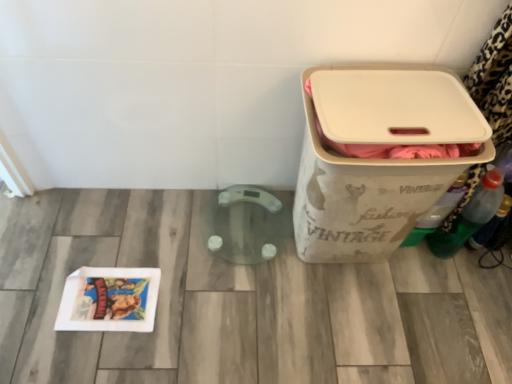
Measure the distance between point (432, 207) and camera.

The depth of point (432, 207) is 1.22 meters.

What is the approximate width of green plastic bottle at right, arranged as the third bottle when viewed from the right?

3.97 inches.

What is the approximate width of green plastic bottle at right, arranged as the second bottle when viewed from the right?

It is 3.89 inches.

The image size is (512, 384). I want to click on beige fabric storage bin at right, so click(378, 159).

This screenshot has width=512, height=384. Find the location of `translucent plastic bottle at right, marked as the 3th bottle in a left-to-right arrangement`. translucent plastic bottle at right, marked as the 3th bottle in a left-to-right arrangement is located at coordinates (490, 225).

You are a GUI agent. You are given a task and a screenshot of the screen. Output one action in this format:
    pyautogui.click(x=<x>, y=<y>)
    Task: Click on the green plastic bottle at right, which is the first bottle from left to right
    This screenshot has width=512, height=384.
    Given the screenshot: What is the action you would take?
    pyautogui.click(x=444, y=204)

Based on the photo, is green plastic bottle at right, arranged as the second bottle when viewed from the right, oriented away from beige fabric storage bin at right?

Yes, green plastic bottle at right, arranged as the second bottle when viewed from the right, is facing away from beige fabric storage bin at right.

Locate an element on the screen. This screenshot has width=512, height=384. the 2nd bottle behind the beige fabric storage bin at right, starting your count from the anchor is located at coordinates (470, 216).

Is beige fabric storage bin at right a part of green plastic bottle at right, the 2th bottle viewed from the left?

No, green plastic bottle at right, the 2th bottle viewed from the left, does not contain beige fabric storage bin at right.

Image resolution: width=512 pixels, height=384 pixels. I want to click on the 1st bottle below when counting from the green plastic bottle at right, arranged as the third bottle when viewed from the right (from the image's perspective), so 470,216.

Is green plastic bottle at right, arranged as the second bottle when viewed from the right, positioned with its back to green plastic bottle at right, which is the first bottle from left to right?

Yes, green plastic bottle at right, which is the first bottle from left to right, is at the back of green plastic bottle at right, arranged as the second bottle when viewed from the right.

Looking at this image, considering the positions of objects green plastic bottle at right, the 2th bottle viewed from the left, and green plastic bottle at right, arranged as the third bottle when viewed from the right, in the image provided, who is in front, green plastic bottle at right, the 2th bottle viewed from the left, or green plastic bottle at right, arranged as the third bottle when viewed from the right,?

green plastic bottle at right, arranged as the third bottle when viewed from the right, is closer to the camera.

Does green plastic bottle at right, which is the first bottle from left to right, turn towards beige fabric storage bin at right?

No, green plastic bottle at right, which is the first bottle from left to right, does not turn towards beige fabric storage bin at right.

Would you say green plastic bottle at right, which is the first bottle from left to right, is outside beige fabric storage bin at right?

Absolutely, green plastic bottle at right, which is the first bottle from left to right, is external to beige fabric storage bin at right.

From the picture: Which is more to the right, green plastic bottle at right, arranged as the third bottle when viewed from the right, or beige fabric storage bin at right?

Positioned to the right is green plastic bottle at right, arranged as the third bottle when viewed from the right.

Between beige fabric storage bin at right and translucent plastic bottle at right, marked as the 3th bottle in a left-to-right arrangement, which one has smaller width?

translucent plastic bottle at right, marked as the 3th bottle in a left-to-right arrangement, is thinner.

From the image's perspective, which object appears higher, beige fabric storage bin at right or translucent plastic bottle at right, the first bottle when ordered from right to left?

From the image's view, beige fabric storage bin at right is above.

How many degrees apart are the facing directions of beige fabric storage bin at right and translucent plastic bottle at right, the first bottle when ordered from right to left?

72.1 degrees separate the facing orientations of beige fabric storage bin at right and translucent plastic bottle at right, the first bottle when ordered from right to left.

Looking at this image, considering the sizes of beige fabric storage bin at right and translucent plastic bottle at right, marked as the 3th bottle in a left-to-right arrangement, in the image, is beige fabric storage bin at right taller or shorter than translucent plastic bottle at right, marked as the 3th bottle in a left-to-right arrangement,?

Clearly, beige fabric storage bin at right is taller compared to translucent plastic bottle at right, marked as the 3th bottle in a left-to-right arrangement.

Do you think translucent plastic bottle at right, marked as the 3th bottle in a left-to-right arrangement, is within beige fabric storage bin at right, or outside of it?

translucent plastic bottle at right, marked as the 3th bottle in a left-to-right arrangement, is not inside beige fabric storage bin at right, it's outside.

From the image's perspective, which object appears higher, translucent plastic bottle at right, the first bottle when ordered from right to left, or beige fabric storage bin at right?

beige fabric storage bin at right is shown above in the image.

In the image, is translucent plastic bottle at right, marked as the 3th bottle in a left-to-right arrangement, positioned in front of or behind beige fabric storage bin at right?

Visually, translucent plastic bottle at right, marked as the 3th bottle in a left-to-right arrangement, is located behind beige fabric storage bin at right.

Does beige fabric storage bin at right turn towards green plastic bottle at right, arranged as the second bottle when viewed from the right?

No, beige fabric storage bin at right is not facing towards green plastic bottle at right, arranged as the second bottle when viewed from the right.

Considering the relative sizes of beige fabric storage bin at right and green plastic bottle at right, the 2th bottle viewed from the left, in the image provided, is beige fabric storage bin at right wider than green plastic bottle at right, the 2th bottle viewed from the left,?

Yes, beige fabric storage bin at right is wider than green plastic bottle at right, the 2th bottle viewed from the left.

Is beige fabric storage bin at right spatially inside green plastic bottle at right, the 2th bottle viewed from the left, or outside of it?

beige fabric storage bin at right exists outside the volume of green plastic bottle at right, the 2th bottle viewed from the left.

From a real-world perspective, is beige fabric storage bin at right located higher than green plastic bottle at right, arranged as the second bottle when viewed from the right?

Yes, from a real-world perspective, beige fabric storage bin at right is on top of green plastic bottle at right, arranged as the second bottle when viewed from the right.

Is green plastic bottle at right, arranged as the second bottle when viewed from the right, at the right side of translucent plastic bottle at right, the first bottle when ordered from right to left?

In fact, green plastic bottle at right, arranged as the second bottle when viewed from the right, is to the left of translucent plastic bottle at right, the first bottle when ordered from right to left.

Does green plastic bottle at right, arranged as the second bottle when viewed from the right, have a larger size compared to translucent plastic bottle at right, marked as the 3th bottle in a left-to-right arrangement?

Correct, green plastic bottle at right, arranged as the second bottle when viewed from the right, is larger in size than translucent plastic bottle at right, marked as the 3th bottle in a left-to-right arrangement.

In the scene shown: Is green plastic bottle at right, the 2th bottle viewed from the left, turned away from translucent plastic bottle at right, the first bottle when ordered from right to left?

No, translucent plastic bottle at right, the first bottle when ordered from right to left, is not at the back of green plastic bottle at right, the 2th bottle viewed from the left.

The image size is (512, 384). I want to click on bottle on the right of green plastic bottle at right, arranged as the second bottle when viewed from the right, so click(490, 225).

Find the location of `waste container on the left of green plastic bottle at right, the 2th bottle viewed from the left`. waste container on the left of green plastic bottle at right, the 2th bottle viewed from the left is located at coordinates (378, 159).

Find the location of a particular element. This screenshot has height=384, width=512. the 1st bottle to the right of the green plastic bottle at right, which is the first bottle from left to right, counting from the anchor's position is located at coordinates pos(470,216).

Looking at the image, which one is located further to green plastic bottle at right, arranged as the second bottle when viewed from the right, green plastic bottle at right, which is the first bottle from left to right, or beige fabric storage bin at right?

beige fabric storage bin at right is positioned further to the anchor green plastic bottle at right, arranged as the second bottle when viewed from the right.

From the image, which object appears to be nearer to green plastic bottle at right, arranged as the second bottle when viewed from the right, green plastic bottle at right, arranged as the third bottle when viewed from the right, or translucent plastic bottle at right, the first bottle when ordered from right to left?

translucent plastic bottle at right, the first bottle when ordered from right to left, is closer to green plastic bottle at right, arranged as the second bottle when viewed from the right.

Which object lies nearer to the anchor point beige fabric storage bin at right, green plastic bottle at right, arranged as the third bottle when viewed from the right, or translucent plastic bottle at right, marked as the 3th bottle in a left-to-right arrangement?

green plastic bottle at right, arranged as the third bottle when viewed from the right, lies closer to beige fabric storage bin at right than the other object.

Looking at the image, which one is located further to translucent plastic bottle at right, the first bottle when ordered from right to left, green plastic bottle at right, which is the first bottle from left to right, or beige fabric storage bin at right?

Based on the image, beige fabric storage bin at right appears to be further to translucent plastic bottle at right, the first bottle when ordered from right to left.

Considering their positions, is beige fabric storage bin at right positioned closer to green plastic bottle at right, arranged as the third bottle when viewed from the right, than translucent plastic bottle at right, marked as the 3th bottle in a left-to-right arrangement?

Based on the image, translucent plastic bottle at right, marked as the 3th bottle in a left-to-right arrangement, appears to be nearer to green plastic bottle at right, arranged as the third bottle when viewed from the right.

Looking at the image, which one is located further to green plastic bottle at right, the 2th bottle viewed from the left, beige fabric storage bin at right or green plastic bottle at right, which is the first bottle from left to right?

Among the two, beige fabric storage bin at right is located further to green plastic bottle at right, the 2th bottle viewed from the left.

Estimate the real-world distances between objects in this image. Which object is closer to translucent plastic bottle at right, the first bottle when ordered from right to left, green plastic bottle at right, arranged as the third bottle when viewed from the right, or green plastic bottle at right, the 2th bottle viewed from the left?

green plastic bottle at right, the 2th bottle viewed from the left.

When comparing their distances from green plastic bottle at right, which is the first bottle from left to right, does green plastic bottle at right, the 2th bottle viewed from the left, or translucent plastic bottle at right, marked as the 3th bottle in a left-to-right arrangement, seem closer?

green plastic bottle at right, the 2th bottle viewed from the left.

Identify the location of bottle between green plastic bottle at right, which is the first bottle from left to right, and translucent plastic bottle at right, the first bottle when ordered from right to left. (470, 216).

I want to click on bottle between beige fabric storage bin at right and green plastic bottle at right, arranged as the second bottle when viewed from the right, from left to right, so click(x=444, y=204).